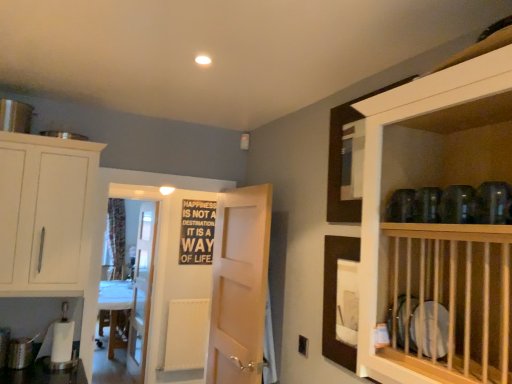
Question: Based on their sizes in the image, would you say floral fabric curtain at left is bigger or smaller than white wooden door at center, which appears as the first door when viewed from the right?

Choices:
 (A) big
 (B) small

Answer: (A)

Question: From a real-world perspective, is floral fabric curtain at left physically located above or below white wooden door at center, which is the second door from left to right?

Choices:
 (A) above
 (B) below

Answer: (A)

Question: Estimate the real-world distances between objects in this image. Which object is closer to the white wooden door at center, the second door from the back?

Choices:
 (A) white wooden door at center, placed as the 2th door when sorted from front to back
 (B) white wood cabinet at left
 (C) black matte sign at center
 (D) floral fabric curtain at left
 (E) white glossy table at center

Answer: (B)

Question: Which is nearer to the white wooden door at center, which is the second door from left to right?

Choices:
 (A) black matte sign at center
 (B) floral fabric curtain at left
 (C) white wood cabinet at left
 (D) white wooden door at center, the 2th door in the right-to-left sequence
 (E) white glossy table at center

Answer: (C)